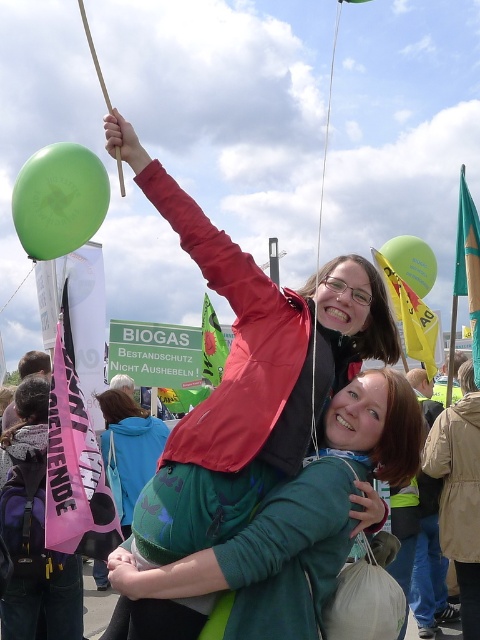
Based on the scene description and the objects provided, what is located at the coordinates point (296,520)?

The green fabric jacket at upper center is located at point (296,520).

You are a photographer trying to capture both the matte red jacket at center and the green fabric jacket at upper center in a single frame. Given their sizes, which jacket will appear bigger in your photo?

The matte red jacket at center will appear bigger in the photo because it is larger in size than the green fabric jacket at upper center.

You are a photographer trying to capture a photo of the matte red jacket at center and the green fabric jacket at upper center. Based on their positions, which jacket should you focus on first to ensure both are in frame?

The matte red jacket at center is above the green fabric jacket at upper center, so focusing on the green fabric jacket at upper center first will ensure both are in frame.